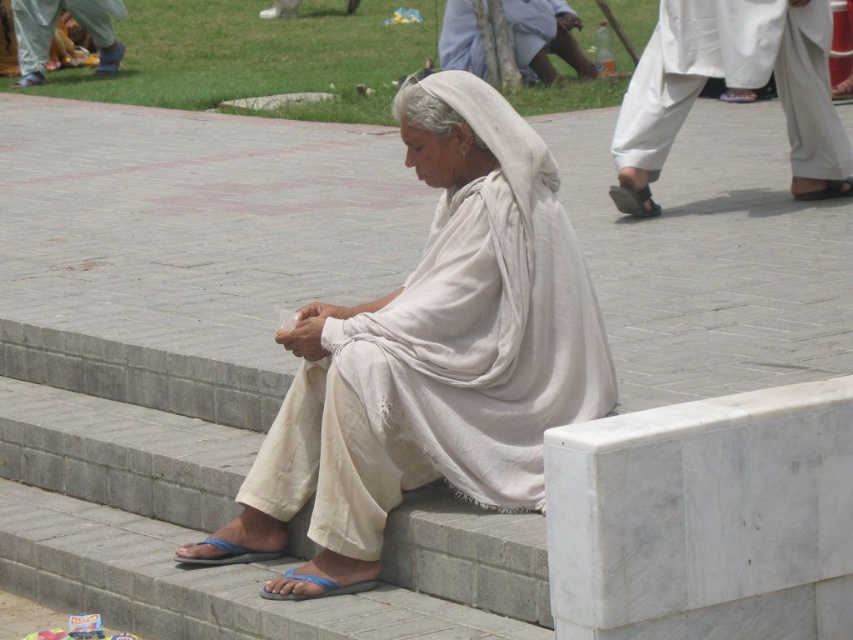
Question: In this image, where is white cotton robe at right located relative to white cotton robe at upper left?

Choices:
 (A) left
 (B) right

Answer: (B)

Question: Which point appears farthest from the camera in this image?

Choices:
 (A) [x=416, y=164]
 (B) [x=753, y=40]
 (C) [x=474, y=26]

Answer: (C)

Question: Which point is farther from the camera taking this photo?

Choices:
 (A) (463, 1)
 (B) (328, 486)

Answer: (A)

Question: Which point appears closest to the camera in this image?

Choices:
 (A) click(532, 225)
 (B) click(18, 3)
 (C) click(676, 116)

Answer: (A)

Question: Does white cotton robe at right have a larger size compared to white cotton robe at upper center?

Choices:
 (A) yes
 (B) no

Answer: (A)

Question: Does white cotton robe at right have a larger size compared to white cotton robe at upper center?

Choices:
 (A) no
 (B) yes

Answer: (B)